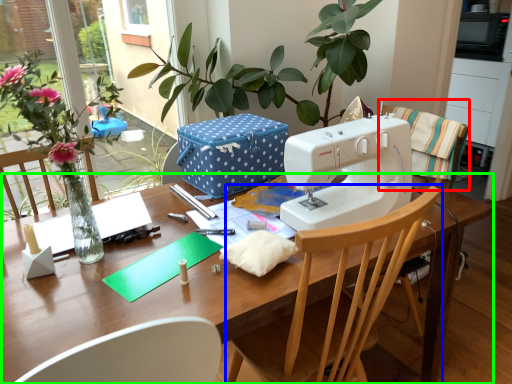
Question: Considering the real-world distances, which object is farthest from chair (highlighted by a red box)? chair (highlighted by a blue box) or table (highlighted by a green box)?

Choices:
 (A) chair
 (B) table

Answer: (B)